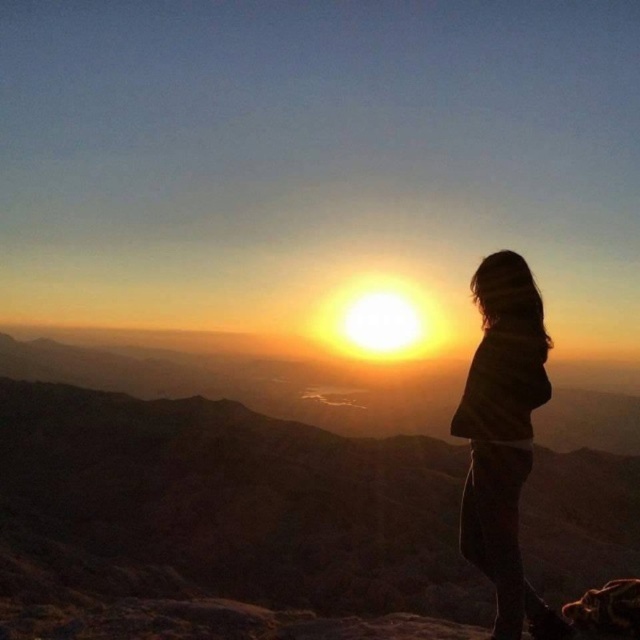
Question: Which of the following is the farthest from the observer?

Choices:
 (A) (628, 544)
 (B) (563, 637)

Answer: (A)

Question: Is brown rocky mountain at center to the left of brown textured sweater at right from the viewer's perspective?

Choices:
 (A) no
 (B) yes

Answer: (B)

Question: Does brown rocky mountain at center have a larger size compared to brown textured sweater at right?

Choices:
 (A) yes
 (B) no

Answer: (A)

Question: Which point appears farthest from the camera in this image?

Choices:
 (A) (595, 540)
 (B) (465, 394)

Answer: (A)

Question: Can you confirm if brown rocky mountain at center is positioned to the right of brown textured sweater at right?

Choices:
 (A) no
 (B) yes

Answer: (A)